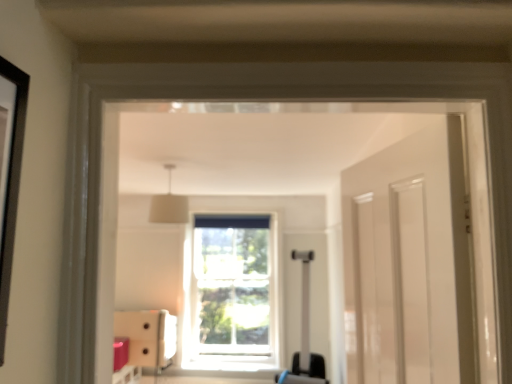
Question: Could you tell me if clear glass window at center is turned towards white fabric lampshade at upper center?

Choices:
 (A) yes
 (B) no

Answer: (A)

Question: Considering the relative sizes of clear glass window at center and white fabric lampshade at upper center in the image provided, is clear glass window at center shorter than white fabric lampshade at upper center?

Choices:
 (A) yes
 (B) no

Answer: (B)

Question: Would you consider clear glass window at center to be distant from white fabric lampshade at upper center?

Choices:
 (A) yes
 (B) no

Answer: (A)

Question: Considering the relative positions of clear glass window at center and white fabric lampshade at upper center in the image provided, is clear glass window at center behind white fabric lampshade at upper center?

Choices:
 (A) no
 (B) yes

Answer: (B)

Question: Are clear glass window at center and white fabric lampshade at upper center making contact?

Choices:
 (A) no
 (B) yes

Answer: (A)

Question: From a real-world perspective, relative to matte white cabinet at lower left, is matte black suitcase at center vertically above or below?

Choices:
 (A) below
 (B) above

Answer: (B)

Question: Looking at their shapes, would you say matte black suitcase at center is wider or thinner than matte white cabinet at lower left?

Choices:
 (A) wide
 (B) thin

Answer: (A)

Question: From the image's perspective, relative to matte white cabinet at lower left, is matte black suitcase at center above or below?

Choices:
 (A) below
 (B) above

Answer: (B)

Question: In terms of height, does matte black suitcase at center look taller or shorter compared to matte white cabinet at lower left?

Choices:
 (A) short
 (B) tall

Answer: (B)

Question: Relative to matte black suitcase at center, is matte white cabinet at lower left in front or behind?

Choices:
 (A) front
 (B) behind

Answer: (B)

Question: Is matte white cabinet at lower left to the left or to the right of matte black suitcase at center in the image?

Choices:
 (A) right
 (B) left

Answer: (B)

Question: From a real-world perspective, is matte white cabinet at lower left positioned above or below matte black suitcase at center?

Choices:
 (A) above
 (B) below

Answer: (B)

Question: Is matte white cabinet at lower left wider or thinner than matte black suitcase at center?

Choices:
 (A) thin
 (B) wide

Answer: (A)

Question: Is white fabric lampshade at upper center inside or outside of clear glass window at center?

Choices:
 (A) outside
 (B) inside

Answer: (A)

Question: Considering the relative positions of white fabric lampshade at upper center and clear glass window at center in the image provided, is white fabric lampshade at upper center to the left or to the right of clear glass window at center?

Choices:
 (A) left
 (B) right

Answer: (A)